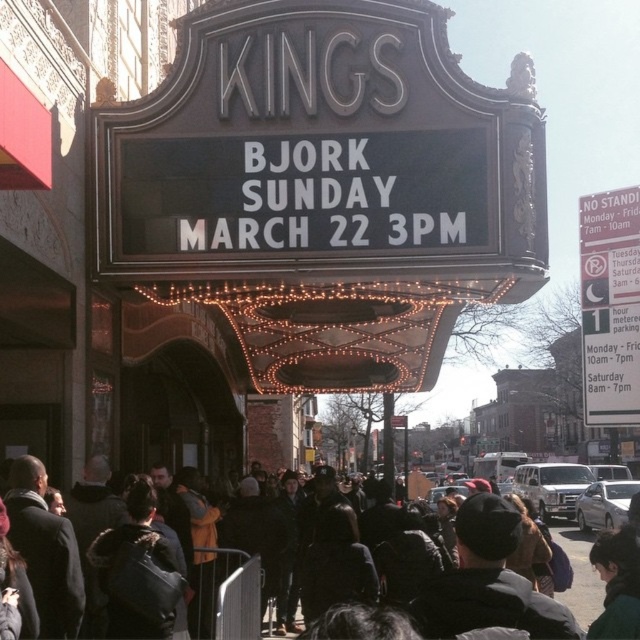
You are a pedestrian standing in front of the theater marquee. You see a white paper sign at right and a dark gray jacket at center. Which object is higher up in the scene?

The white paper sign at right is located above the dark gray jacket at center, so it is higher up in the scene.